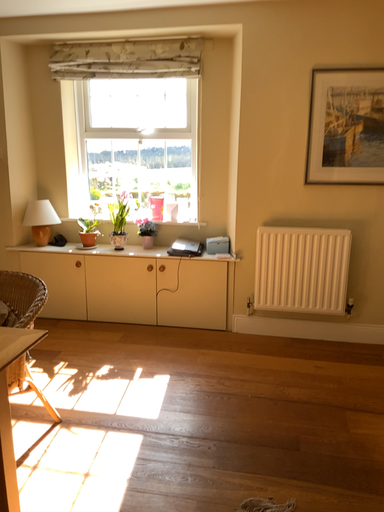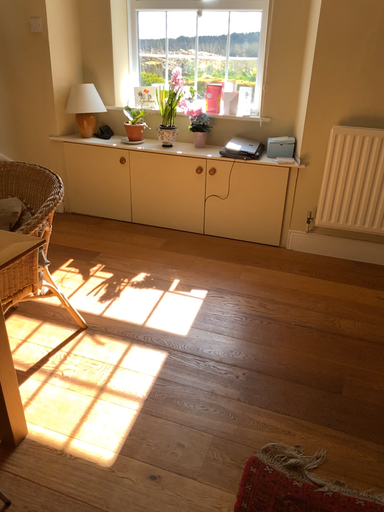
Question: Which way did the camera rotate in the video?

Choices:
 (A) rotated upward
 (B) rotated downward

Answer: (B)